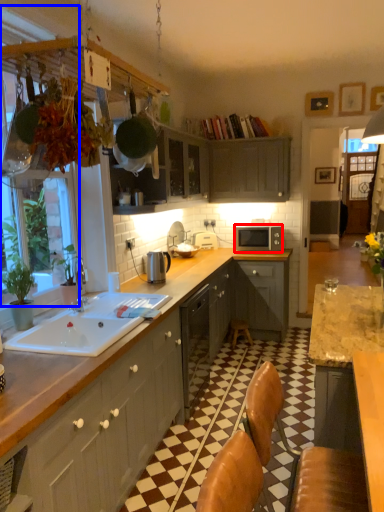
Question: Which object appears farthest to the camera in this image, microwave oven (highlighted by a red box) or window screen (highlighted by a blue box)?

Choices:
 (A) microwave oven
 (B) window screen

Answer: (A)